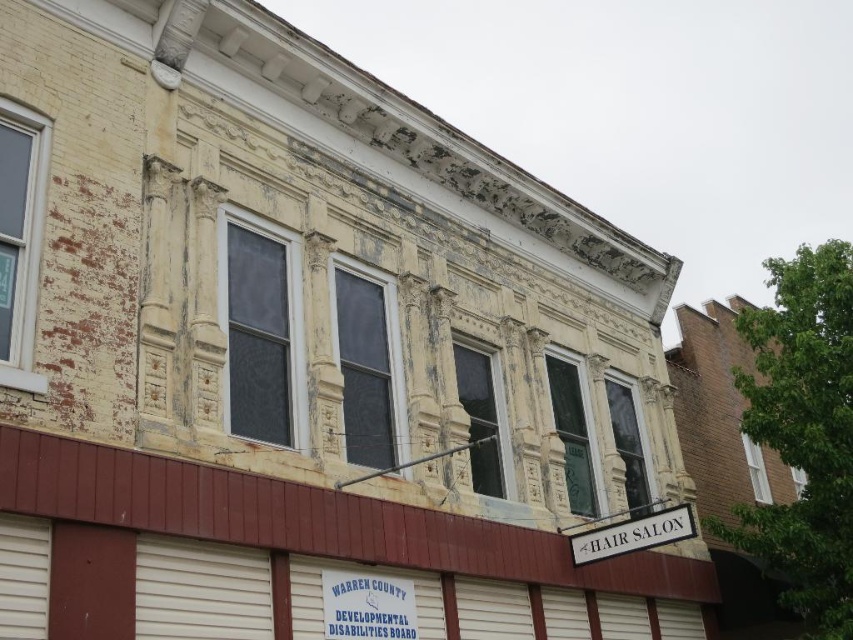
You are a delivery person who needs to place a new sign that is 2 feet wide between the blue plastic sign at lower center and the white plastic hair salon sign at lower right. Can you fit the new sign between them without overlapping either existing sign?

The blue plastic sign at lower center and white plastic hair salon sign at lower right are 40.76 feet apart from each other. Since the new sign is only 2 feet wide, there is sufficient space between them to place it without overlapping either existing sign.

You are standing in front of the building and want to locate the blue plastic sign at lower center. According to the coordinates provided, where should you look relative to the building?

The blue plastic sign at lower center is located at coordinates point [367,605], which means it is positioned near the bottom right corner of the building facade.

You are standing in front of the building and notice two points marked on its facade. The first point is at coordinates point (383, 588) and the second is at point (663, 529). Which of these two points is closer to you?

Point (383, 588) is closer to the viewer than point (663, 529).